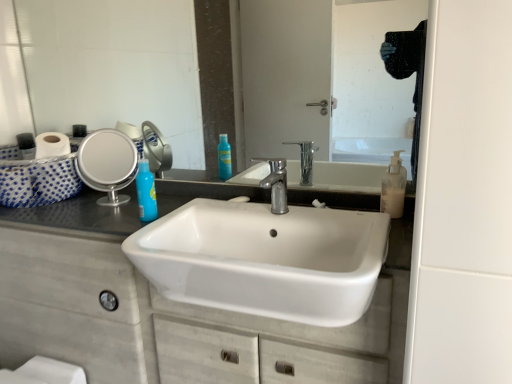
This screenshot has width=512, height=384. I want to click on free space to the left of translucent plastic soap dispenser at right, so click(x=332, y=208).